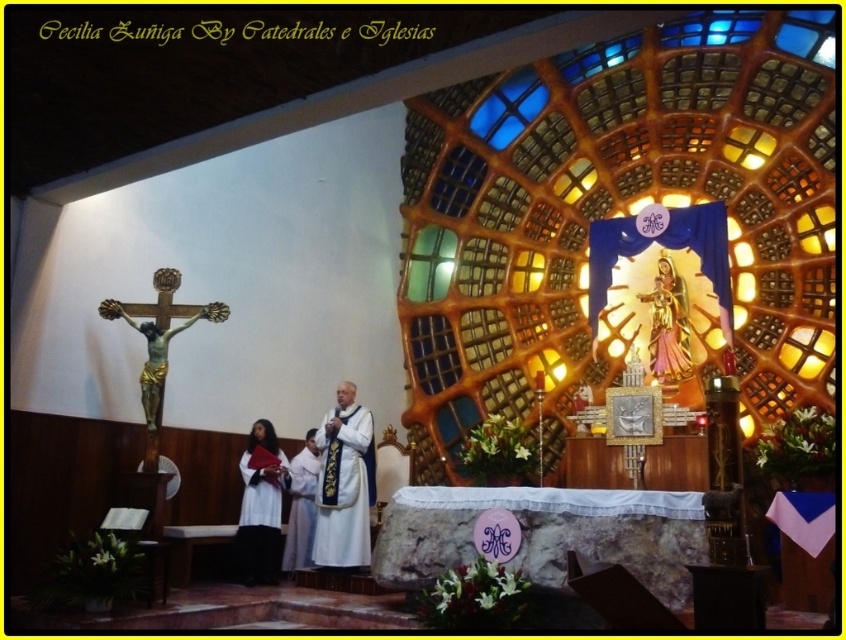
You are standing at the entrance of the church and see the altar area. There is a crucifix on the left and a person in white clothes at center. Where is the point located at coordinates (301, 506)?

The point at (301, 506) is on the white clothed person at center.

You are an interior designer planning to install a new chandelier in the church. The chandelier will hang directly above the altar area. Considering the current setup, how far apart are the white silk vestment at center and the white clothed person at center?

The distance between the white silk vestment at center and the white clothed person at center is 5.03 meters.

You are an interior designer tasked with arranging a new candle holder between the white silk vestment at center and the gold metallic statue at upper center. Which object should the candle holder be placed closer to if it needs to be near the smaller object?

The gold metallic statue at upper center is smaller than the white silk vestment at center, so the candle holder should be placed closer to the gold metallic statue at upper center.